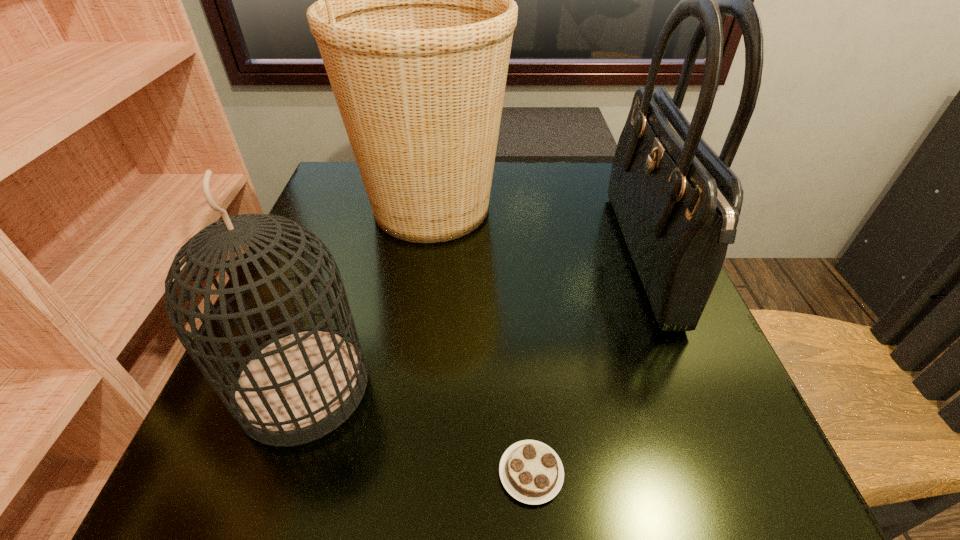
Find the location of a particular element. Image resolution: width=960 pixels, height=540 pixels. basket is located at coordinates (414, 22).

Locate an element on the screen. The image size is (960, 540). the rightmost object is located at coordinates (677, 202).

Where is `birdcage`? This screenshot has width=960, height=540. birdcage is located at coordinates (297, 387).

The height and width of the screenshot is (540, 960). Find the location of `chocolate cake`. chocolate cake is located at coordinates (531, 472).

Locate an element on the screen. vacant space located 0.270m on the front of the basket is located at coordinates (409, 366).

Find the location of `free space located with an open clasp on the front of the rightmost object`. free space located with an open clasp on the front of the rightmost object is located at coordinates (559, 258).

Where is `blank space located with an open clasp on the front of the rightmost object`? blank space located with an open clasp on the front of the rightmost object is located at coordinates (515, 258).

At what (x,y) coordinates should I click in order to perform the action: click on vacant region located 0.300m with an open clasp on the front of the rightmost object. Please return your answer as a coordinate pair (x, y). This screenshot has height=540, width=960. Looking at the image, I should click on (475, 258).

Identify the location of vacant area situated 0.390m on the back of the birdcage. The height and width of the screenshot is (540, 960). point(364,207).

The height and width of the screenshot is (540, 960). I want to click on free location located on the back of the shortest object, so click(x=519, y=336).